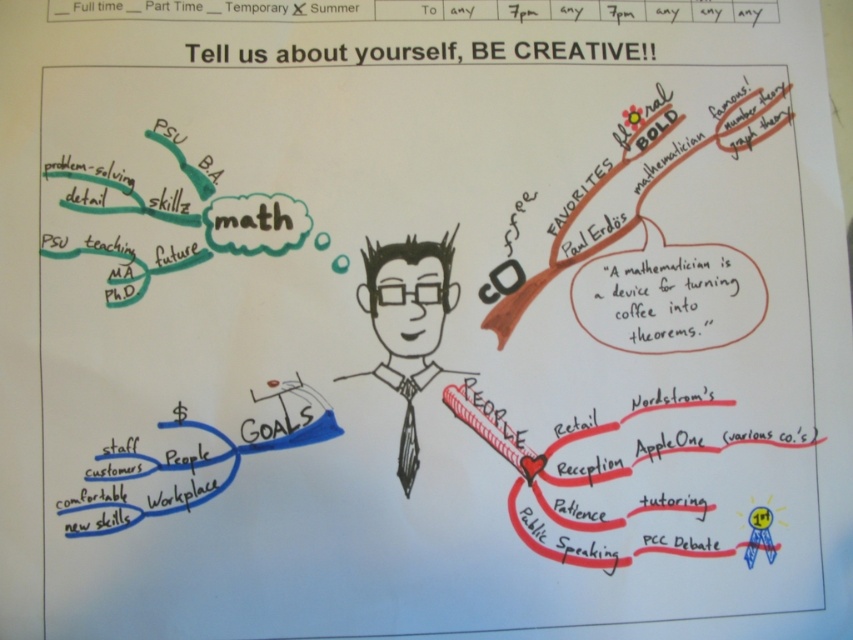
Does point (445, 241) lie behind point (412, 429)?

Yes, point (445, 241) is behind point (412, 429).

Is black ink drawing of man at center shorter than black silk tie at center?

Incorrect, black ink drawing of man at center's height does not fall short of black silk tie at center's.

Which is in front, point (380, 250) or point (409, 416)?

Positioned in front is point (409, 416).

Identify the location of black ink drawing of man at center. (408, 323).